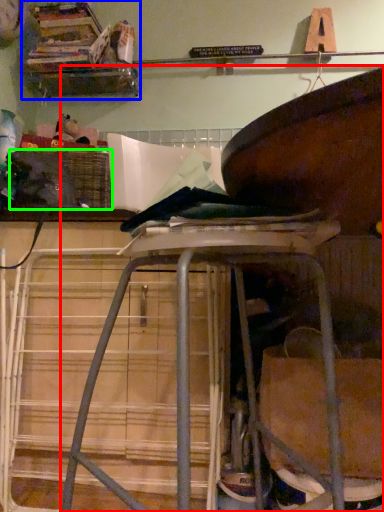
Question: Which object is the farthest from furniture (highlighted by a red box)? Choose among these: shelf (highlighted by a blue box) or crate (highlighted by a green box).

Choices:
 (A) shelf
 (B) crate

Answer: (A)